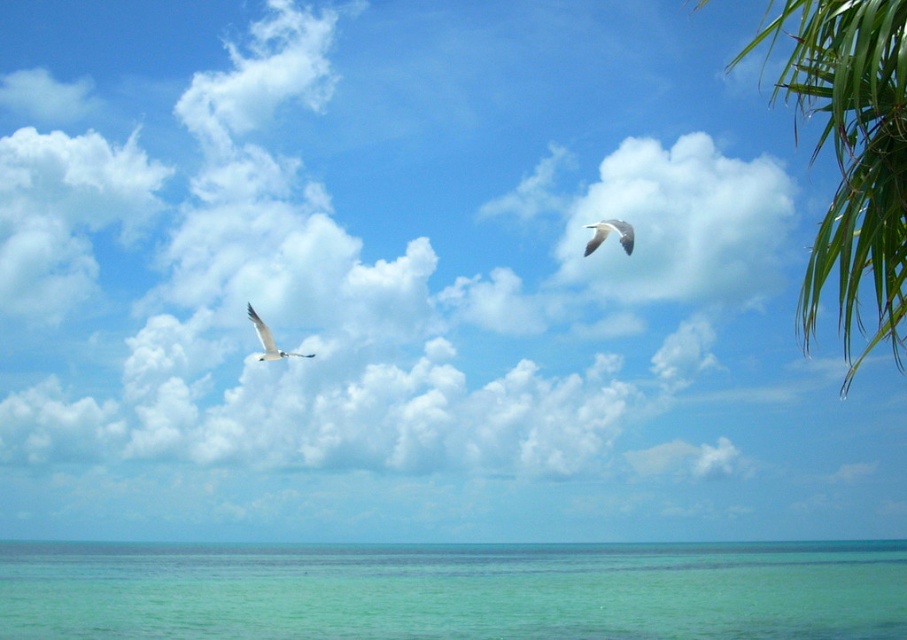
You are standing on the beach and see the point marked at coordinates point (455, 592). Based on the scene description, where is this point located?

The point (455, 592) is on clear water at lower center.